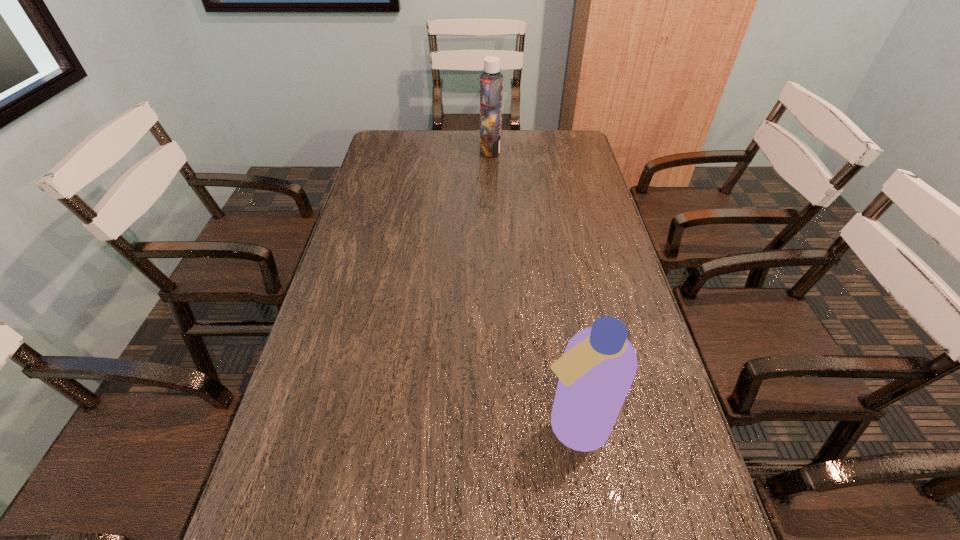
Identify the location of the farther shampoo. The height and width of the screenshot is (540, 960). (491, 81).

This screenshot has width=960, height=540. Find the location of `the second object from left to right`. the second object from left to right is located at coordinates (491, 81).

At what (x,y) coordinates should I click in order to perform the action: click on the nearer shampoo. Please return your answer as a coordinate pair (x, y). The height and width of the screenshot is (540, 960). Looking at the image, I should click on (595, 373).

The height and width of the screenshot is (540, 960). In order to click on the right shampoo in this screenshot , I will do `click(595, 373)`.

Identify the location of free region located 0.180m on the front label of the farther shampoo. The width and height of the screenshot is (960, 540). (435, 150).

Find the location of a particular element. Image resolution: width=960 pixels, height=540 pixels. vacant region located 0.200m on the front label of the farther shampoo is located at coordinates (429, 150).

The image size is (960, 540). I want to click on vacant space located 0.090m on the front label of the farther shampoo, so click(457, 150).

Find the location of `vacant area situated on the left of the rightmost object`. vacant area situated on the left of the rightmost object is located at coordinates (507, 426).

Locate an element on the screen. object present at the far edge is located at coordinates (491, 81).

Identify the location of object located in the right edge section of the desktop. (595, 373).